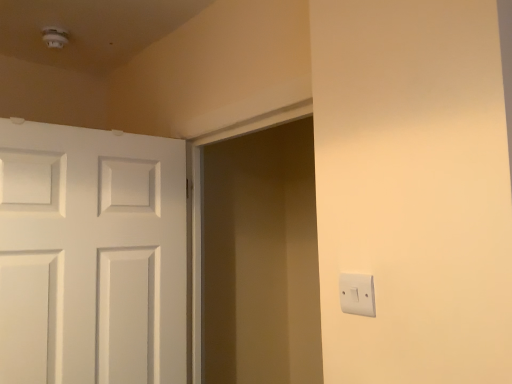
Question: Is white plastic light switch at right far away from white painted wood door at left?

Choices:
 (A) yes
 (B) no

Answer: (B)

Question: Is the position of white plastic light switch at right less distant than that of white painted wood door at left?

Choices:
 (A) no
 (B) yes

Answer: (B)

Question: Is white plastic light switch at right at the right side of white painted wood door at left?

Choices:
 (A) yes
 (B) no

Answer: (A)

Question: From a real-world perspective, is white plastic light switch at right located higher than white painted wood door at left?

Choices:
 (A) no
 (B) yes

Answer: (A)

Question: Is the depth of white plastic light switch at right greater than that of white painted wood door at left?

Choices:
 (A) yes
 (B) no

Answer: (B)

Question: Based on their sizes in the image, would you say matte white screen door at center is bigger or smaller than white painted wood door at left?

Choices:
 (A) small
 (B) big

Answer: (A)

Question: Considering the positions of matte white screen door at center and white painted wood door at left in the image, is matte white screen door at center taller or shorter than white painted wood door at left?

Choices:
 (A) short
 (B) tall

Answer: (A)

Question: Looking at their shapes, would you say matte white screen door at center is wider or thinner than white painted wood door at left?

Choices:
 (A) thin
 (B) wide

Answer: (A)

Question: Based on their positions, is matte white screen door at center located to the left or right of white painted wood door at left?

Choices:
 (A) left
 (B) right

Answer: (B)

Question: Considering their positions, is matte white screen door at center located in front of or behind white plastic light switch at right?

Choices:
 (A) behind
 (B) front

Answer: (A)

Question: Is point (270, 228) closer or farther from the camera than point (361, 312)?

Choices:
 (A) farther
 (B) closer

Answer: (A)

Question: From the image's perspective, is matte white screen door at center above or below white plastic light switch at right?

Choices:
 (A) below
 (B) above

Answer: (A)

Question: Looking at the image, does matte white screen door at center seem bigger or smaller compared to white plastic light switch at right?

Choices:
 (A) small
 (B) big

Answer: (B)

Question: Based on their positions, is white plastic light switch at right located to the left or right of matte white screen door at center?

Choices:
 (A) left
 (B) right

Answer: (B)

Question: From the image's perspective, is white plastic light switch at right above or below matte white screen door at center?

Choices:
 (A) above
 (B) below

Answer: (A)